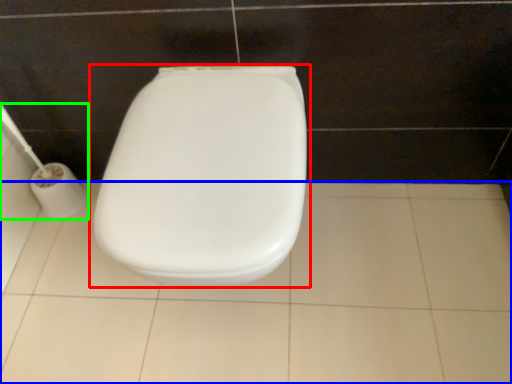
Question: Considering the real-world distances, which object is farthest from toilet (highlighted by a red box)? ceramic tile (highlighted by a blue box) or toilet paper (highlighted by a green box)?

Choices:
 (A) ceramic tile
 (B) toilet paper

Answer: (B)